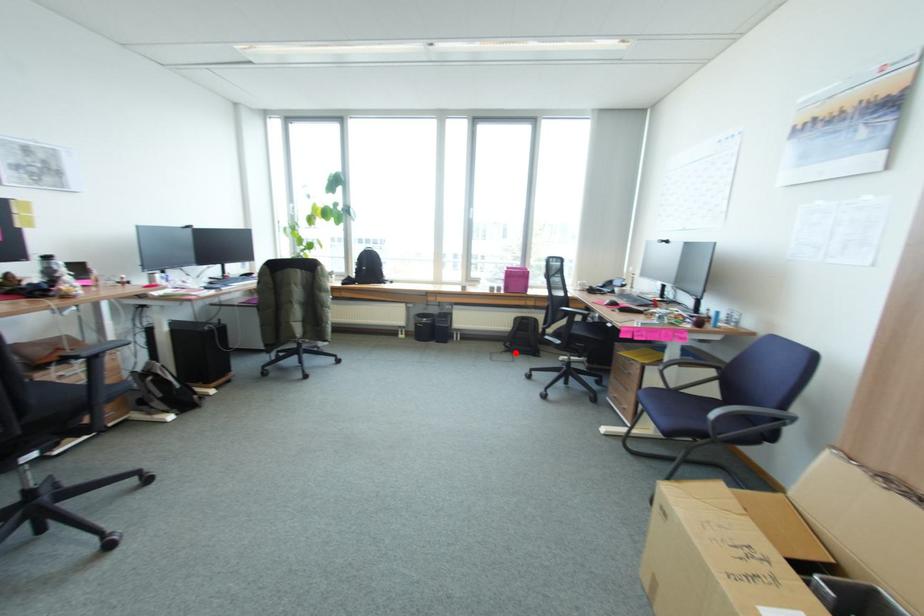
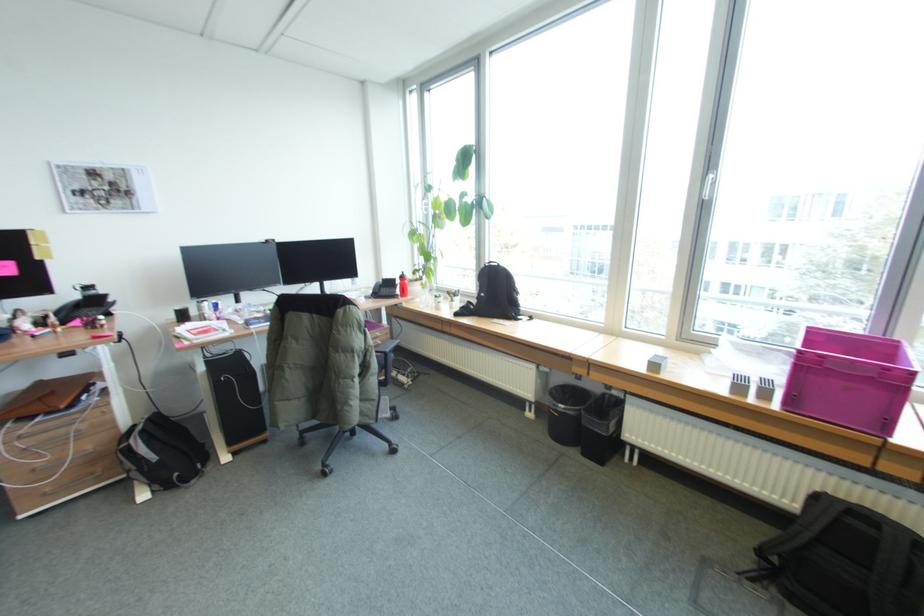
Question: I am providing you with two images of the same scene from different viewpoints. A red point is shown in image1. For the corresponding object point in image2, is it positioned nearer or farther from the camera?

Choices:
 (A) Nearer
 (B) Farther

Answer: (A)